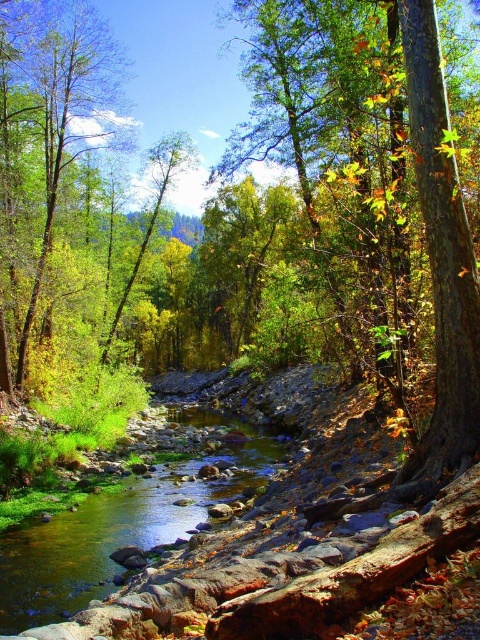
Is the position of clear water at stream center less distant than that of green leafy tree at center?

Yes.

Is clear water at stream center shorter than green leafy tree at center?

Yes.

This screenshot has height=640, width=480. In order to click on clear water at stream center in this screenshot , I will do `click(117, 529)`.